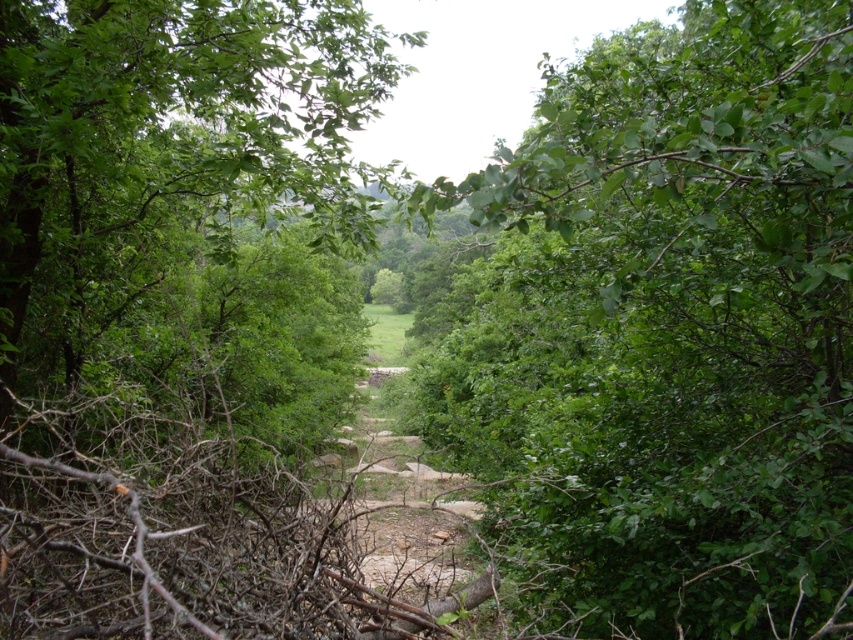
Can you confirm if green leafy bush at center is taller than green leafy tree at center?

Yes, green leafy bush at center is taller than green leafy tree at center.

Can you confirm if green leafy bush at center is positioned to the left of green leafy tree at center?

No, green leafy bush at center is not to the left of green leafy tree at center.

Between point (564, 464) and point (71, 301), which one is positioned in front?

Positioned in front is point (564, 464).

I want to click on green leafy bush at center, so click(670, 332).